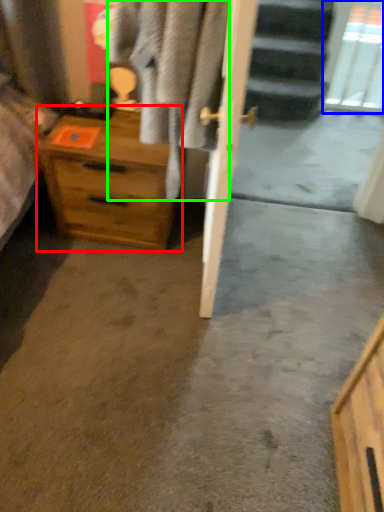
Question: Which object is positioned closest to chest of drawers (highlighted by a red box)? Select from glass door (highlighted by a blue box) and clothing (highlighted by a green box).

Choices:
 (A) glass door
 (B) clothing

Answer: (B)